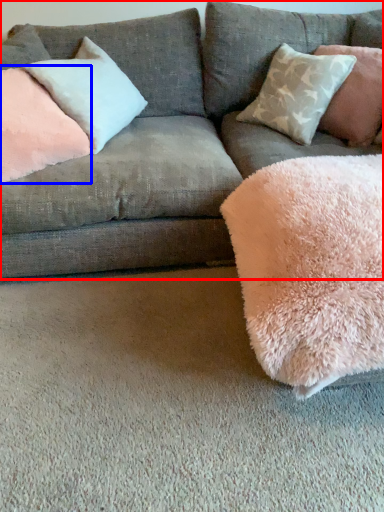
Question: Which of the following is the closest to the observer, studio couch (highlighted by a red box) or pillow (highlighted by a blue box)?

Choices:
 (A) studio couch
 (B) pillow

Answer: (A)